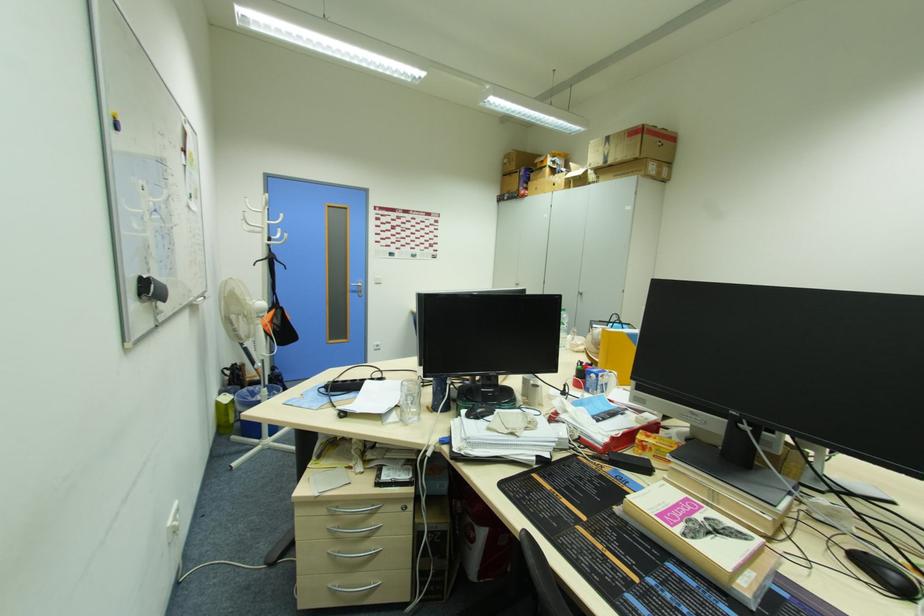
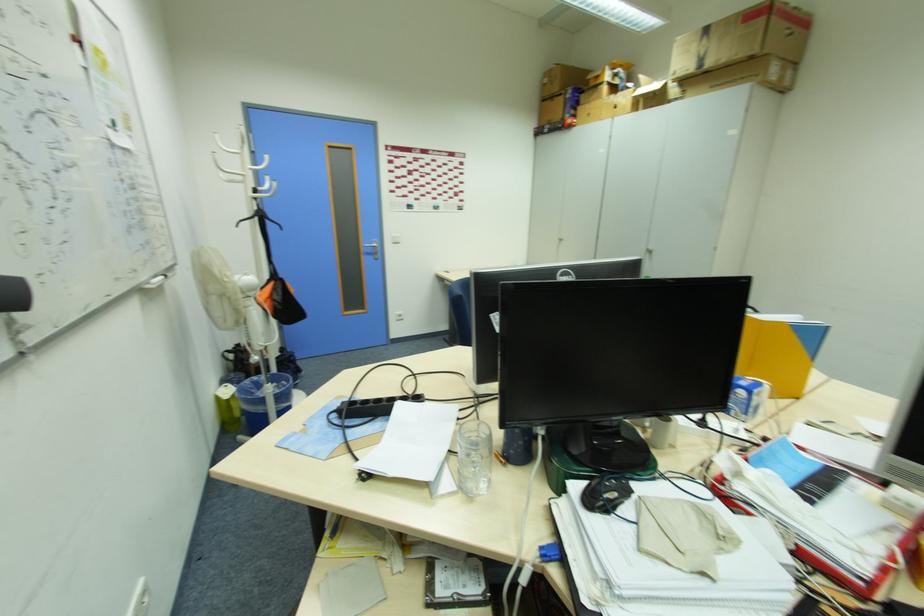
The point at (405, 416) is marked in the first image. Where is the corresponding point in the second image?

(464, 483)